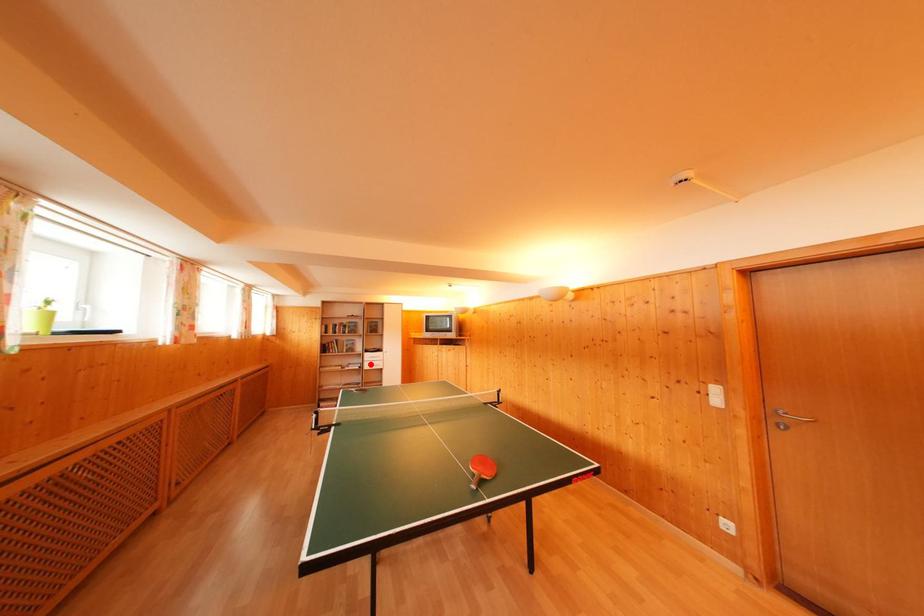
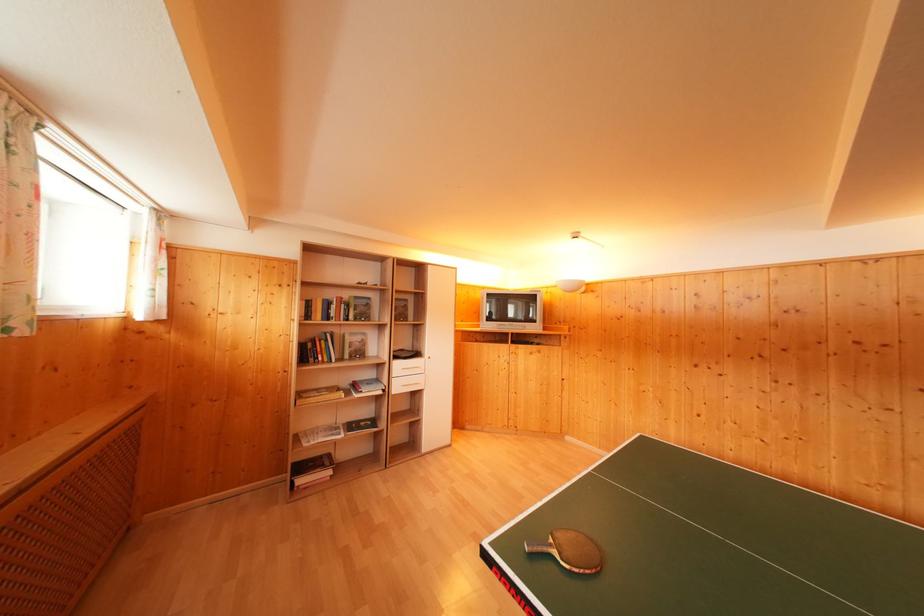
Where in the second image is the point corresponding to the highlighted location from the first image?

(398, 379)